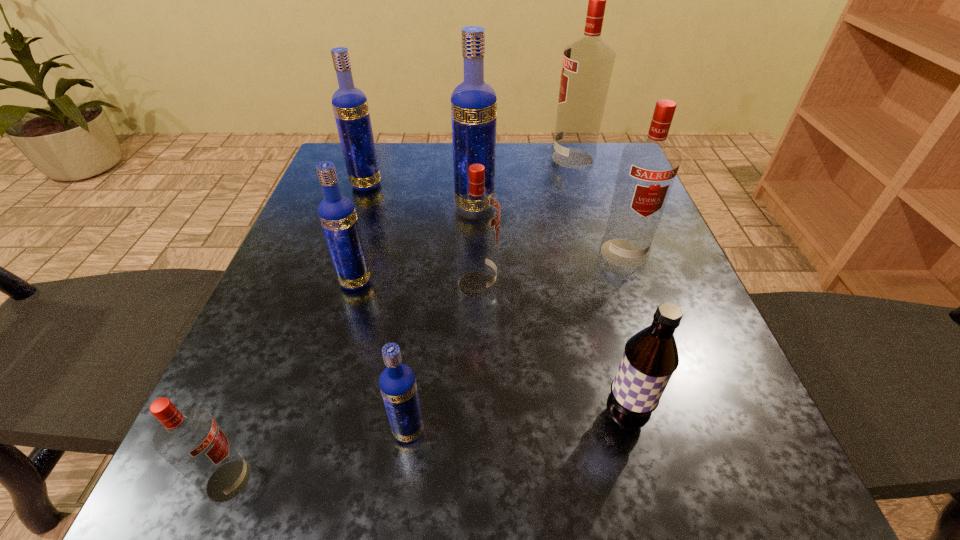
Where is `object present at the near left corner`? object present at the near left corner is located at coordinates (189, 439).

This screenshot has width=960, height=540. Identify the location of object situated at the far right corner. (587, 65).

Identify the location of vacant space at the far edge. (554, 180).

What are the coordinates of `free location at the near edge` in the screenshot? It's located at 490,477.

In the image, there is a desktop. Where is `vacant space at the left edge`? The image size is (960, 540). vacant space at the left edge is located at coordinates (346, 195).

You are a GUI agent. You are given a task and a screenshot of the screen. Output one action in this format:
    pyautogui.click(x=<x>, y=<y>)
    Task: Click on the vacant space at the right edge
    This screenshot has height=540, width=960.
    Given the screenshot: What is the action you would take?
    pyautogui.click(x=595, y=240)

Locate an element on the screen. vacant space at the far left corner of the desktop is located at coordinates (342, 154).

Find the location of `vacant space at the far right corner of the desktop`. vacant space at the far right corner of the desktop is located at coordinates (621, 150).

Locate an element on the screen. vacant area that lies between the farthest blue vodka and the third farthest object is located at coordinates (420, 196).

Find the location of a particular element. Image resolution: width=960 pixels, height=540 pixels. free space that is in between the second nearest vodka and the fourth farthest vodka is located at coordinates (516, 342).